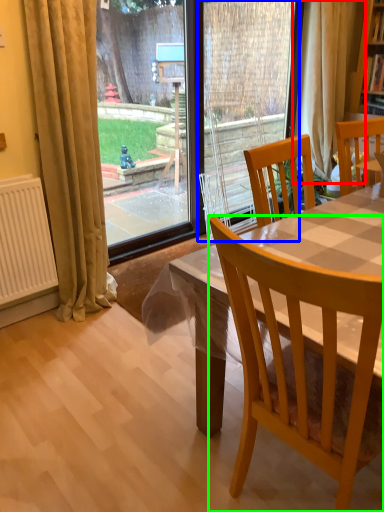
Question: Which object is positioned closest to curtain (highlighted by a red box)? Select from screen door (highlighted by a blue box) and chair (highlighted by a green box).

Choices:
 (A) screen door
 (B) chair

Answer: (A)